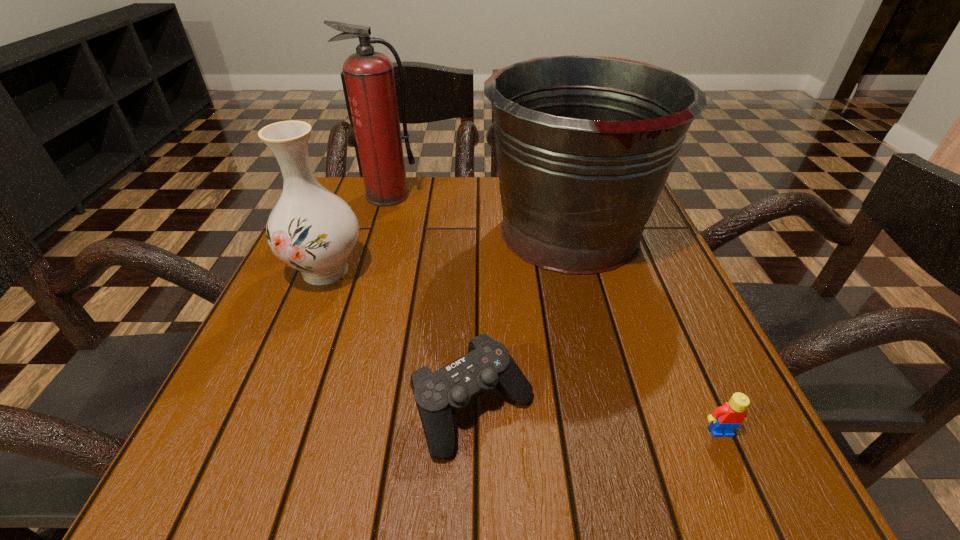
At what (x,y) coordinates should I click in order to perform the action: click on fire extinguisher positioned at the far edge. Please return your answer as a coordinate pair (x, y). Image resolution: width=960 pixels, height=540 pixels. Looking at the image, I should click on (369, 76).

Locate an element on the screen. The height and width of the screenshot is (540, 960). bucket that is at the far edge is located at coordinates (584, 143).

This screenshot has width=960, height=540. In order to click on Lego located in the near edge section of the desktop in this screenshot , I will do `click(725, 418)`.

What are the coordinates of `control positioned at the near edge` in the screenshot? It's located at coord(488,365).

The height and width of the screenshot is (540, 960). I want to click on fire extinguisher that is at the left edge, so click(369, 76).

Find the location of a particular element. Image resolution: width=960 pixels, height=540 pixels. vase at the left edge is located at coordinates (310, 229).

This screenshot has height=540, width=960. What are the coordinates of `bucket present at the right edge` in the screenshot? It's located at (584, 143).

Where is `Lego located in the right edge section of the desktop`? The image size is (960, 540). Lego located in the right edge section of the desktop is located at coordinates (725, 418).

At what (x,y) coordinates should I click in order to perform the action: click on object located at the far left corner. Please return your answer as a coordinate pair (x, y). Image resolution: width=960 pixels, height=540 pixels. Looking at the image, I should click on (369, 76).

This screenshot has width=960, height=540. I want to click on object that is at the far right corner, so click(x=584, y=143).